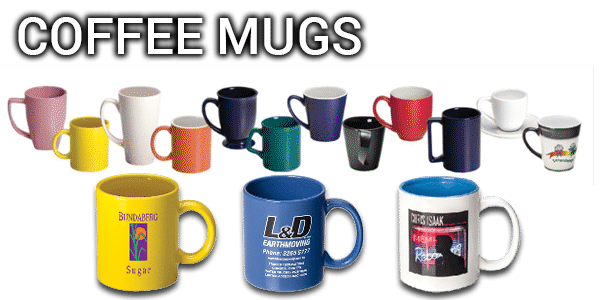
Find the location of a particular element. This screenshot has height=300, width=600. "mugs" is located at coordinates (262, 39).